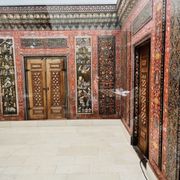
Where is `cord looking object`? The width and height of the screenshot is (180, 180). cord looking object is located at coordinates (144, 175).